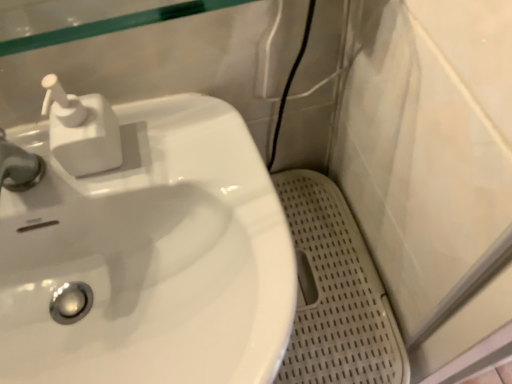
At what (x,y) coordinates should I click in order to perform the action: click on white plastic soap dispenser at upper left. Please return your answer as a coordinate pair (x, y). The height and width of the screenshot is (384, 512). Looking at the image, I should click on (81, 130).

Considering the relative sizes of white plastic soap dispenser at upper left and white glossy sink at left in the image provided, is white plastic soap dispenser at upper left shorter than white glossy sink at left?

Yes.

Identify the location of soap dispenser above the white glossy sink at left (from a real-world perspective). Image resolution: width=512 pixels, height=384 pixels. (81, 130).

Does point (102, 136) come closer to viewer compared to point (276, 212)?

No, (102, 136) is further to viewer.

What's the angular difference between white plastic soap dispenser at upper left and white glossy sink at left's facing directions?

0.000293 degrees.

Looking at this image, from the image's perspective, is white perforated mat at lower right under white plastic soap dispenser at upper left?

Yes, from the image's perspective, white perforated mat at lower right is beneath white plastic soap dispenser at upper left.

Does white perforated mat at lower right have a greater height compared to white plastic soap dispenser at upper left?

Indeed, white perforated mat at lower right has a greater height compared to white plastic soap dispenser at upper left.

Is white perforated mat at lower right facing away from white plastic soap dispenser at upper left?

No, white perforated mat at lower right is not facing away from white plastic soap dispenser at upper left.

Which is in front, white perforated mat at lower right or white plastic soap dispenser at upper left?

white plastic soap dispenser at upper left is more forward.

From the picture: From a real-world perspective, does white perforated mat at lower right sit lower than white glossy sink at left?

Correct, in the physical world, white perforated mat at lower right is lower than white glossy sink at left.

How far apart are white perforated mat at lower right and white glossy sink at left?

white perforated mat at lower right and white glossy sink at left are 10.53 inches apart from each other.

Is white perforated mat at lower right facing away from white glossy sink at left?

white perforated mat at lower right is not turned away from white glossy sink at left.

From the image's perspective, would you say white perforated mat at lower right is shown under white glossy sink at left?

Yes, from the image's perspective, white perforated mat at lower right is beneath white glossy sink at left.

From the picture: Considering the relative sizes of white plastic soap dispenser at upper left and white perforated mat at lower right in the image provided, is white plastic soap dispenser at upper left wider than white perforated mat at lower right?

Incorrect, the width of white plastic soap dispenser at upper left does not surpass that of white perforated mat at lower right.

Who is shorter, white plastic soap dispenser at upper left or white perforated mat at lower right?

white plastic soap dispenser at upper left.

From the picture: Can you confirm if white glossy sink at left is wider than white plastic soap dispenser at upper left?

Yes, white glossy sink at left is wider than white plastic soap dispenser at upper left.

Is white glossy sink at left oriented away from white plastic soap dispenser at upper left?

No, white plastic soap dispenser at upper left is not at the back of white glossy sink at left.

Is white glossy sink at left completely or partially outside of white plastic soap dispenser at upper left?

That's correct, white glossy sink at left is outside of white plastic soap dispenser at upper left.

Between point (10, 307) and point (50, 102), which one is positioned in front?

Point (50, 102)

Could you tell me if white glossy sink at left is facing white perforated mat at lower right?

No, white glossy sink at left is not facing towards white perforated mat at lower right.

Can you confirm if white glossy sink at left is positioned to the right of white perforated mat at lower right?

No, white glossy sink at left is not to the right of white perforated mat at lower right.

Is white glossy sink at left situated inside white perforated mat at lower right or outside?

white glossy sink at left is spatially situated outside white perforated mat at lower right.

Measure the distance between white glossy sink at left and white perforated mat at lower right.

They are 10.53 inches apart.

Locate an element on the screen. soap dispenser above the white glossy sink at left (from the image's perspective) is located at coordinates (81, 130).

At what (x,y) coordinates should I click in order to perform the action: click on soap dispenser that is above the white perforated mat at lower right (from a real-world perspective). Please return your answer as a coordinate pair (x, y). Looking at the image, I should click on (81, 130).

Which object lies further to the anchor point white plastic soap dispenser at upper left, white perforated mat at lower right or white glossy sink at left?

white perforated mat at lower right.

Which object lies nearer to the anchor point white glossy sink at left, white perforated mat at lower right or white plastic soap dispenser at upper left?

The object closer to white glossy sink at left is white plastic soap dispenser at upper left.

Based on their spatial positions, is white plastic soap dispenser at upper left or white perforated mat at lower right further from white glossy sink at left?

white perforated mat at lower right is further to white glossy sink at left.

Based on their spatial positions, is white plastic soap dispenser at upper left or white glossy sink at left closer to white perforated mat at lower right?

Based on the image, white glossy sink at left appears to be nearer to white perforated mat at lower right.

From the picture: Estimate the real-world distances between objects in this image. Which object is further from white plastic soap dispenser at upper left, white glossy sink at left or white perforated mat at lower right?

white perforated mat at lower right is positioned further to the anchor white plastic soap dispenser at upper left.

Looking at the image, which one is located closer to white perforated mat at lower right, white glossy sink at left or white plastic soap dispenser at upper left?

Based on the image, white glossy sink at left appears to be nearer to white perforated mat at lower right.

Identify the location of sink between white plastic soap dispenser at upper left and white perforated mat at lower right from left to right. This screenshot has width=512, height=384. (140, 246).